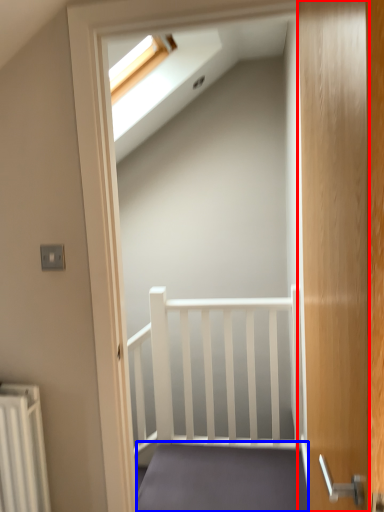
Question: Among these objects, which one is farthest to the camera, door (highlighted by a red box) or stairs (highlighted by a blue box)?

Choices:
 (A) door
 (B) stairs

Answer: (B)